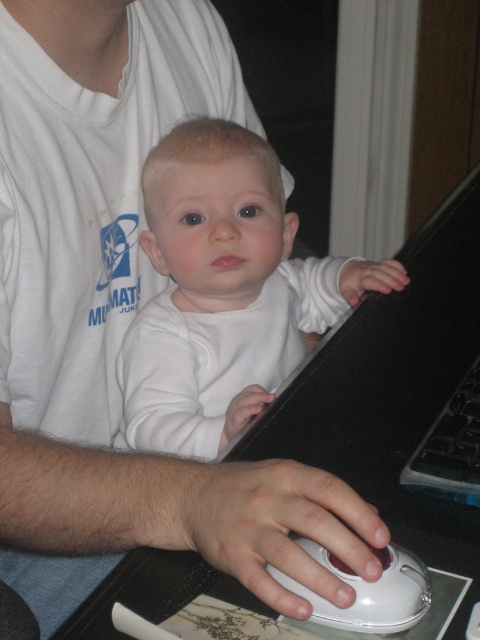
You are a photographer trying to capture the interaction between the white matte baby at center and the white plastic mouse at lower center. To ensure both are in focus, you need to know their positions. Which object is positioned to the left side of the other?

The white matte baby at center is to the left of the white plastic mouse at lower center.